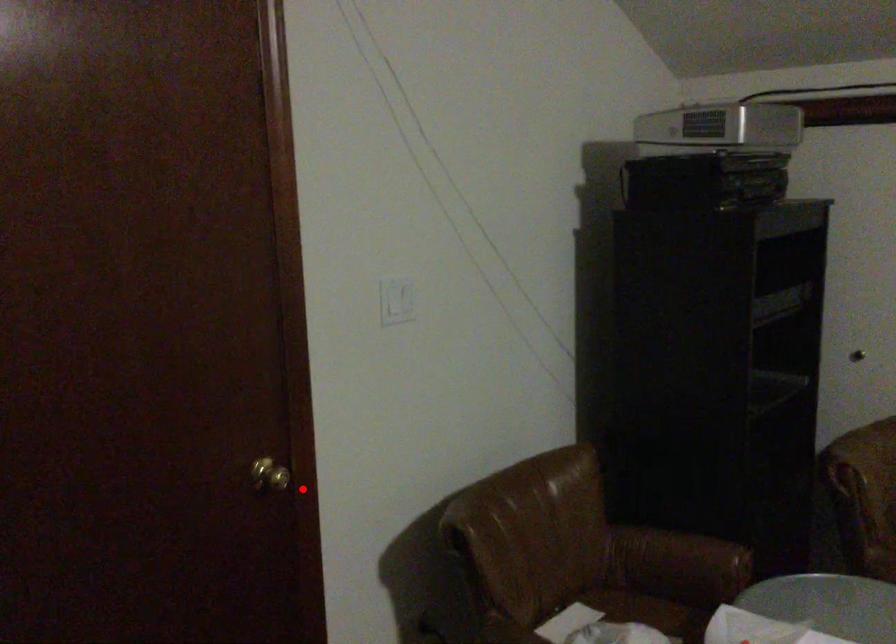
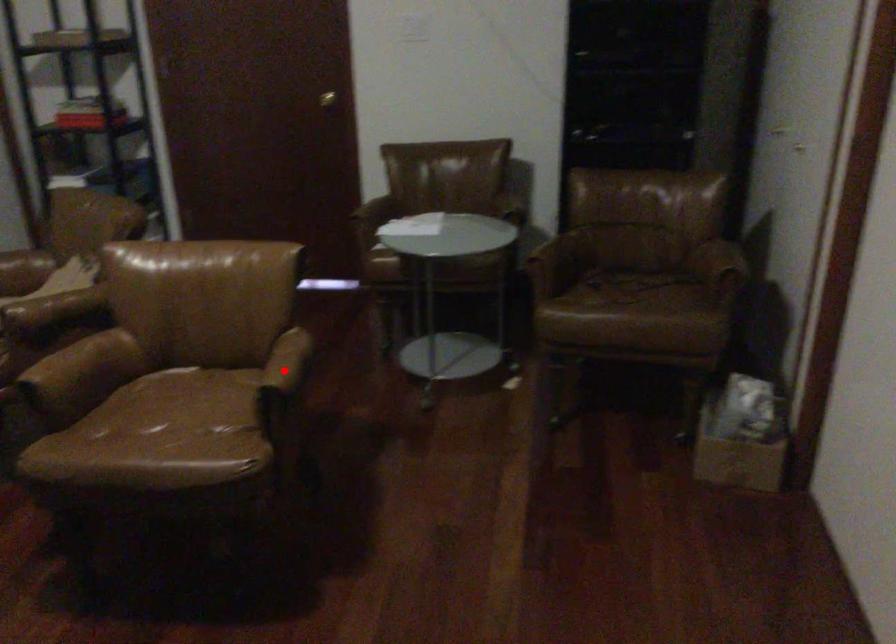
I am providing you with two images of the same scene from different viewpoints. A red point is marked on the first image and another point is marked on the second image. Is the red point in image1 aligned with the point shown in image2?

No